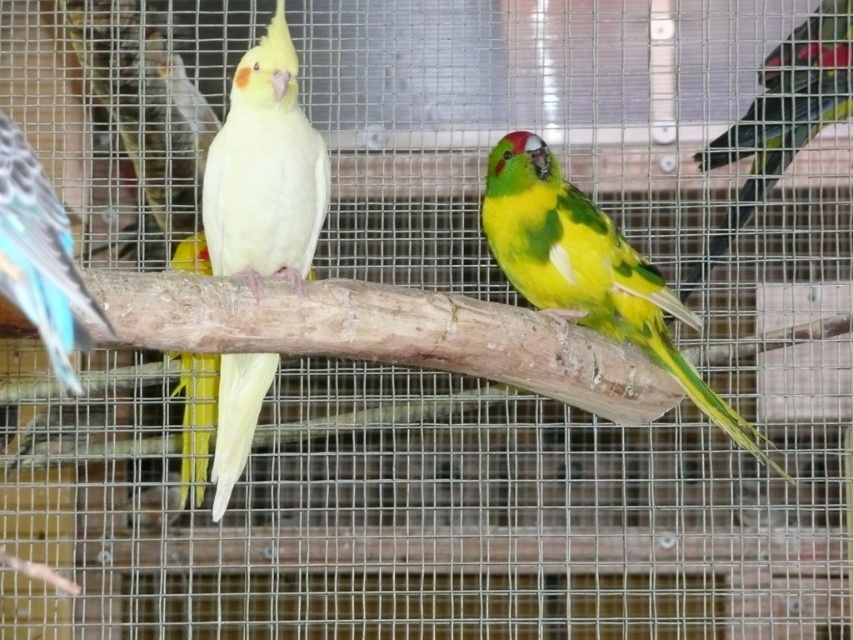
Does point (279, 97) lie behind point (33, 225)?

That is True.

Is matte yellow parrot at center in front of blue glossy wing at left?

No, it is behind blue glossy wing at left.

Find the location of a particular element. Image resolution: width=853 pixels, height=640 pixels. matte yellow parrot at center is located at coordinates (265, 170).

Locate an element on the screen. matte yellow parrot at center is located at coordinates (265, 170).

Is point (221, 243) closer to viewer compared to point (693, 273)?

Yes, point (221, 243) is in front of point (693, 273).

Is matte yellow parrot at center to the left of green glossy parrot at right from the viewer's perspective?

Yes, matte yellow parrot at center is to the left of green glossy parrot at right.

Image resolution: width=853 pixels, height=640 pixels. I want to click on matte yellow parrot at center, so click(265, 170).

In order to click on matte yellow parrot at center in this screenshot , I will do `click(265, 170)`.

Can you confirm if matte yellow parrot at center is taller than green matte parrot at center?

Correct, matte yellow parrot at center is much taller as green matte parrot at center.

What do you see at coordinates (265, 170) in the screenshot? The width and height of the screenshot is (853, 640). I see `matte yellow parrot at center` at bounding box center [265, 170].

Where is `matte yellow parrot at center`? The height and width of the screenshot is (640, 853). matte yellow parrot at center is located at coordinates (265, 170).